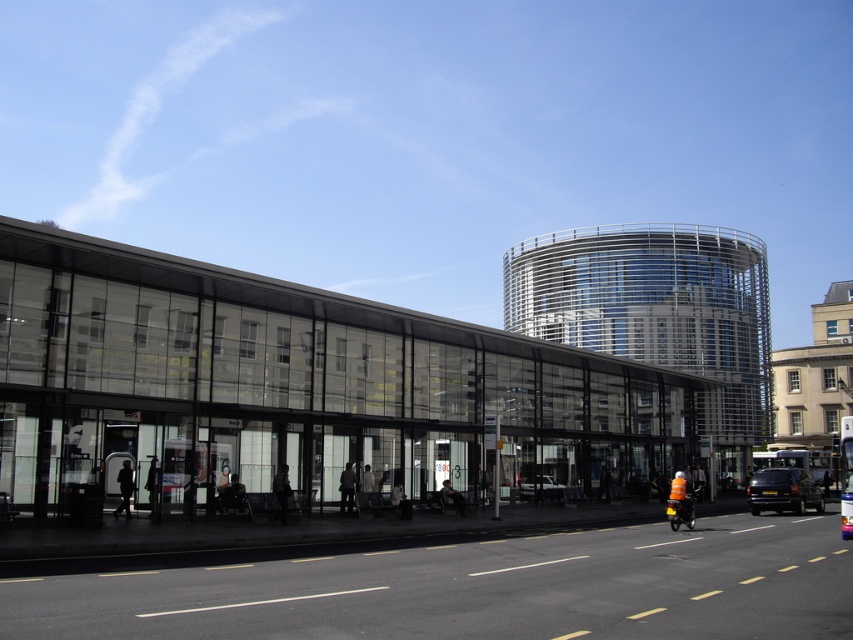
You are standing at the point marked by the coordinates (294, 387) in the image. What structure are you currently located in?

The point marked by the coordinates (294, 387) indicates the transparent glass bus station at center, so you are currently located in the transparent glass bus station at center.

You are a delivery person trying to load a package onto your white glossy car at center. The package is 2 meters tall. Can the package fit inside the transparent glass bus station at center without exceeding its height?

The transparent glass bus station at center is taller than the white glossy car at center. Since the package is 2 meters tall, it may exceed the height of the car but the bus station itself is taller. However, the question is about fitting the package inside the bus station, not the car. Therefore, the package can fit inside the transparent glass bus station at center as it is taller than the car, but this does not confirm the bus station height relative to the package. The description only states the bus s

You are a passenger waiting at the transparent glass bus station at center. You see a blue metallic bus at center approaching your location. Will the bus be able to stop directly in front of you?

The transparent glass bus station at center is above the blue metallic bus at center, so the bus cannot stop directly in front of the station since it is positioned below it.